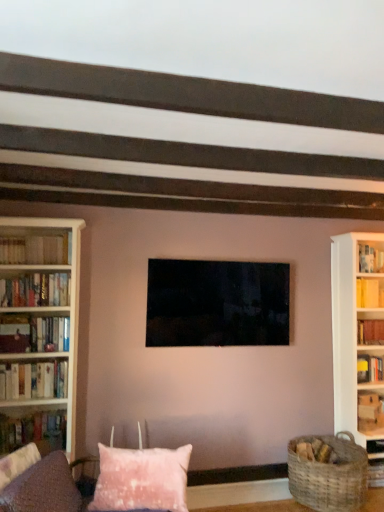
Question: Is hardcover books at left, the 6th book in the bottom-to-top sequence, outside of matte black tv at center?

Choices:
 (A) yes
 (B) no

Answer: (A)

Question: Can you confirm if hardcover books at left, the 5th book when ordered from right to left, is taller than matte black tv at center?

Choices:
 (A) no
 (B) yes

Answer: (A)

Question: Is hardcover books at left, the 5th book when ordered from right to left, far from matte black tv at center?

Choices:
 (A) yes
 (B) no

Answer: (A)

Question: Is hardcover books at left, the 6th book in the bottom-to-top sequence, looking in the opposite direction of matte black tv at center?

Choices:
 (A) yes
 (B) no

Answer: (B)

Question: Does hardcover books at left, the 6th book in the bottom-to-top sequence, lie in front of matte black tv at center?

Choices:
 (A) yes
 (B) no

Answer: (A)

Question: In the image, is hardcover books at left, placed as the 6th book when sorted from right to left, positioned in front of or behind hardcover books at left, placed as the first book when sorted from top to bottom?

Choices:
 (A) behind
 (B) front

Answer: (A)

Question: Would you say hardcover books at left, which appears as the 1th book when viewed from the left, is to the left or to the right of hardcover books at left, placed as the first book when sorted from top to bottom, in the picture?

Choices:
 (A) right
 (B) left

Answer: (B)

Question: Considering the positions of hardcover books at left, acting as the 2th book starting from the top, and hardcover books at left, the 5th book when ordered from right to left, in the image, is hardcover books at left, acting as the 2th book starting from the top, taller or shorter than hardcover books at left, the 5th book when ordered from right to left,?

Choices:
 (A) tall
 (B) short

Answer: (A)

Question: From the image's perspective, relative to hardcover books at left, the 6th book in the bottom-to-top sequence, is hardcover books at left, which appears as the 1th book when viewed from the left, above or below?

Choices:
 (A) above
 (B) below

Answer: (B)

Question: From a real-world perspective, is matte black tv at center physically located above or below hardcover book at left, placed as the fourth book when sorted from left to right?

Choices:
 (A) below
 (B) above

Answer: (B)

Question: Considering the positions of matte black tv at center and hardcover book at left, which is the 1th book from bottom to top, in the image, is matte black tv at center taller or shorter than hardcover book at left, which is the 1th book from bottom to top,?

Choices:
 (A) tall
 (B) short

Answer: (A)

Question: Considering the positions of matte black tv at center and hardcover book at left, which is the 1th book from bottom to top, in the image, is matte black tv at center bigger or smaller than hardcover book at left, which is the 1th book from bottom to top,?

Choices:
 (A) small
 (B) big

Answer: (B)

Question: In terms of width, does matte black tv at center look wider or thinner when compared to hardcover book at left, which is the 1th book from bottom to top?

Choices:
 (A) thin
 (B) wide

Answer: (A)

Question: From a real-world perspective, is white wooden bookcase at left physically located above or below hardcover books at left, the 3th book viewed from the left?

Choices:
 (A) below
 (B) above

Answer: (B)

Question: From the image's perspective, is white wooden bookcase at left above or below hardcover books at left, which is the fifth book from top to bottom?

Choices:
 (A) above
 (B) below

Answer: (A)